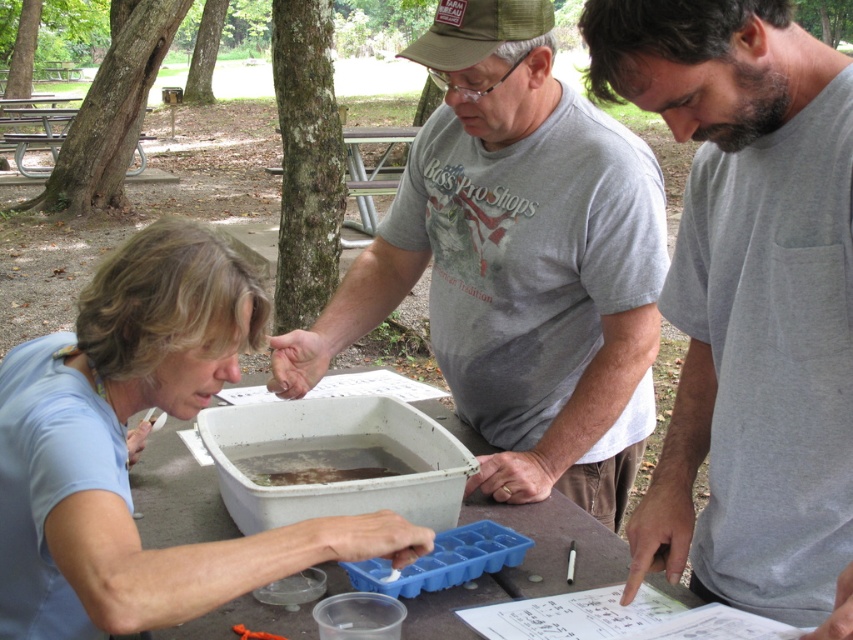
Question: From the image, what is the correct spatial relationship of gray cotton t-shirt at center in relation to white plastic table at center?

Choices:
 (A) right
 (B) left

Answer: (A)

Question: Which object appears farthest from the camera in this image?

Choices:
 (A) light blue fabric at center
 (B) gray cotton t-shirt at center
 (C) translucent plastic container at center

Answer: (C)

Question: Considering the real-world distances, which object is farthest from the gray cotton t-shirt at center?

Choices:
 (A) white plastic table at center
 (B) light blue fabric at center

Answer: (B)

Question: Is light blue fabric at center to the right of white plastic table at center from the viewer's perspective?

Choices:
 (A) yes
 (B) no

Answer: (B)

Question: Can you confirm if white plastic table at center is positioned above translucent plastic container at center?

Choices:
 (A) no
 (B) yes

Answer: (A)

Question: Which object is positioned closest to the translucent plastic container at center?

Choices:
 (A) gray cotton shirt at center
 (B) gray cotton t-shirt at center

Answer: (B)